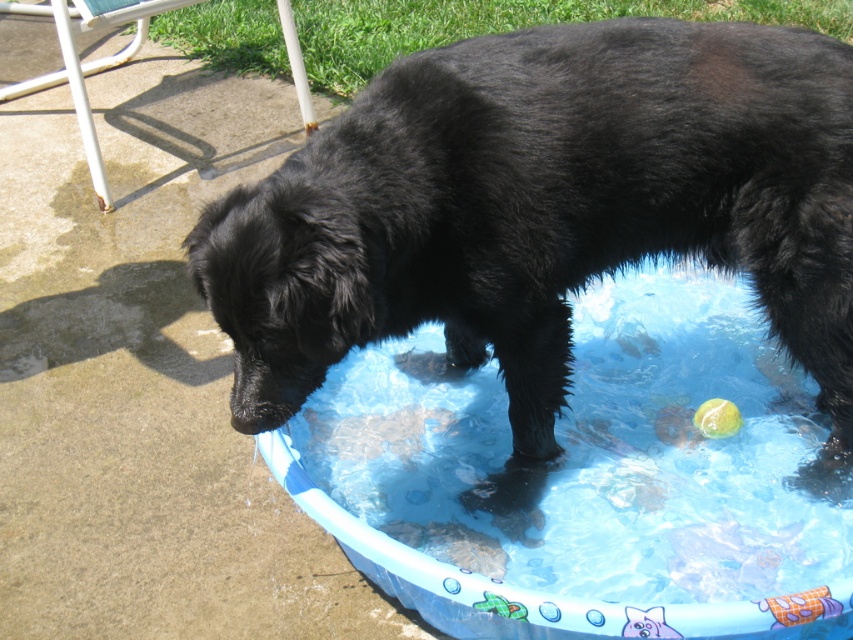
Can you confirm if black fluffy dog at center is positioned below blue plastic pool at center?

No, black fluffy dog at center is not below blue plastic pool at center.

Consider the image. Which of these two, black fluffy dog at center or blue plastic pool at center, stands taller?

With more height is black fluffy dog at center.

Does point (680, 102) come behind point (450, 396)?

No, (680, 102) is in front of (450, 396).

The image size is (853, 640). I want to click on black fluffy dog at center, so click(x=544, y=214).